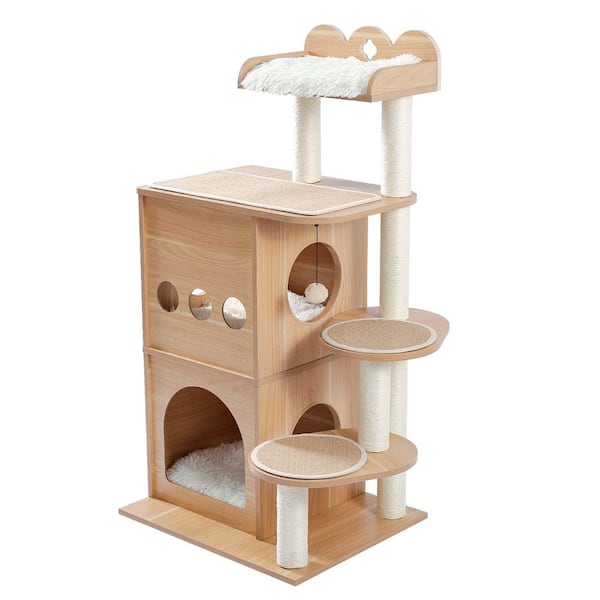
The image size is (600, 600). What are the coordinates of `circular air hole` in the screenshot? It's located at (220, 308), (188, 301), (155, 292).